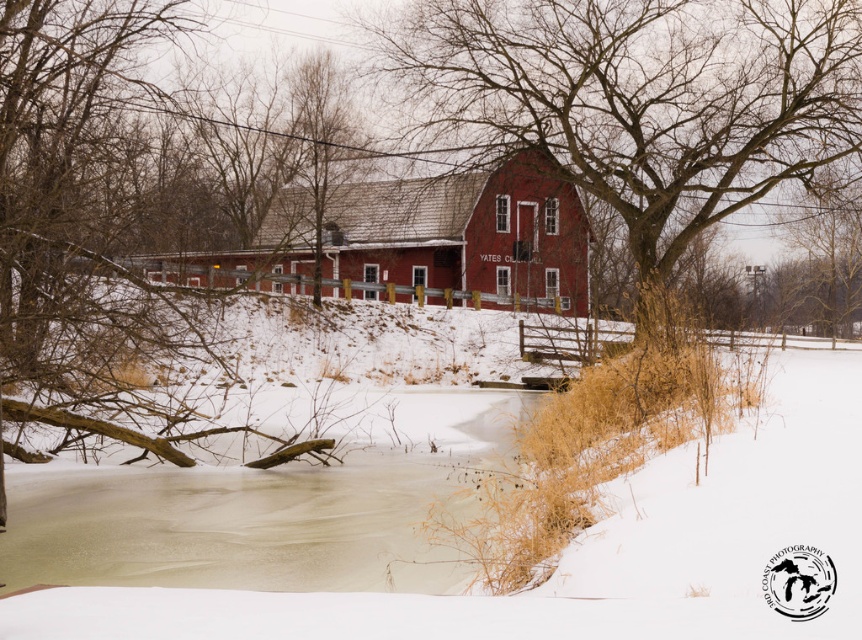
From the picture: You are standing in the winter scene and want to walk from the bare branches at left to the matte red barn at center. Which direction should you head to reach the barn?

You should head to the right because the bare branches at left are to the left of the matte red barn at center, so moving right will take you towards the barn.

You are standing in front of the red barn and want to walk to the frozen pond. There are two points marked on the ground, point A at coordinates point (595, 168) and point B at coordinates point (501, 193). Which point is closer to you as you face the barn?

Point (595, 168) is closer to the viewer than point (501, 193).